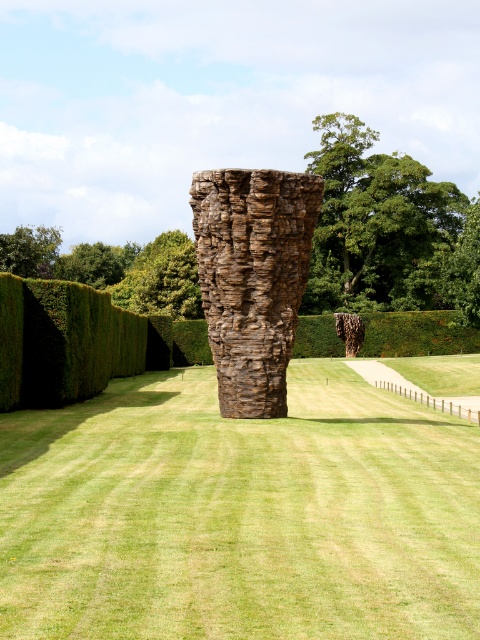
Which is behind, point (315, 208) or point (363, 236)?

Positioned behind is point (363, 236).

Who is more forward, (219, 228) or (367, 296)?

Point (219, 228)

Locate an element on the screen. This screenshot has height=640, width=480. brown textured rock at center is located at coordinates (x=252, y=276).

Does point (219, 616) come closer to viewer compared to point (43, 257)?

Yes, it is in front of point (43, 257).

Which is above, green grass at center or green leafy tree at upper left?

green leafy tree at upper left

Is point (309, 566) farther from camera compared to point (47, 266)?

No, it is in front of (47, 266).

The image size is (480, 640). In order to click on green grass at center in this screenshot , I will do `click(239, 515)`.

Is green grass at center bigger than brown textured rock at center?

Yes.

Can you confirm if green grass at center is positioned above brown textured rock at center?

No, green grass at center is not above brown textured rock at center.

At what (x,y) coordinates should I click in order to perform the action: click on green grass at center. Please return your answer as a coordinate pair (x, y). The height and width of the screenshot is (640, 480). Looking at the image, I should click on (239, 515).